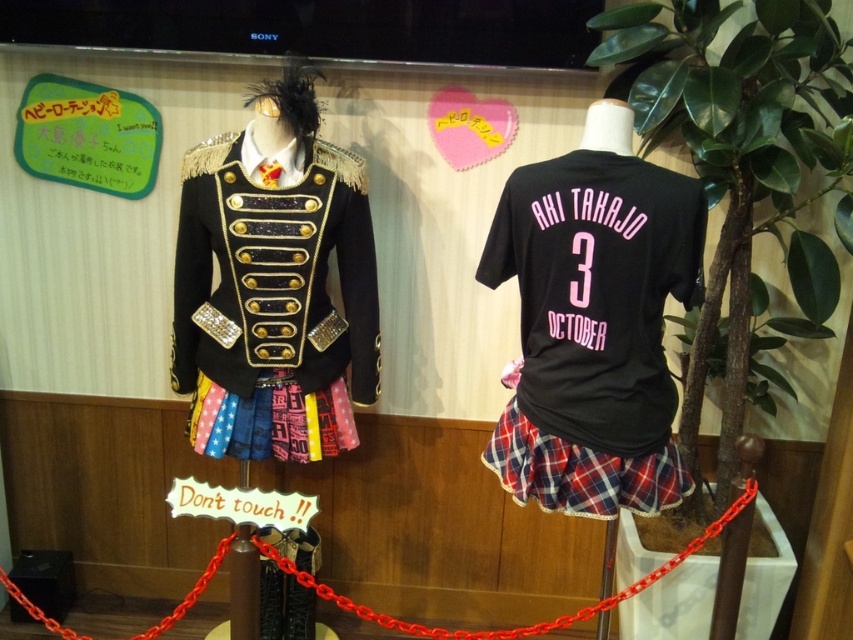
Who is taller, shiny black jacket at center or colorful plaid skirt at center?

Standing taller between the two is shiny black jacket at center.

Is shiny black jacket at center bigger than colorful plaid skirt at center?

Yes.

Describe the element at coordinates (274, 284) in the screenshot. I see `shiny black jacket at center` at that location.

Where is `shiny black jacket at center`? shiny black jacket at center is located at coordinates (274, 284).

Can you confirm if plaid fabric skirt at center is shorter than colorful plaid skirt at center?

In fact, plaid fabric skirt at center may be taller than colorful plaid skirt at center.

Does plaid fabric skirt at center come in front of colorful plaid skirt at center?

That is True.

I want to click on plaid fabric skirt at center, so (579, 472).

You are a GUI agent. You are given a task and a screenshot of the screen. Output one action in this format:
    pyautogui.click(x=<x>, y=<y>)
    Task: Click on the plaid fabric skirt at center
    The image size is (853, 640).
    Given the screenshot: What is the action you would take?
    pyautogui.click(x=579, y=472)

Measure the distance from black jersey at center to plaid fabric skirt at center.

8.56 inches

Which is below, black jersey at center or plaid fabric skirt at center?

plaid fabric skirt at center

Which is behind, point (686, 188) or point (671, 492)?

The point (671, 492) is behind.

Locate an element on the screen. This screenshot has height=640, width=853. black jersey at center is located at coordinates (596, 291).